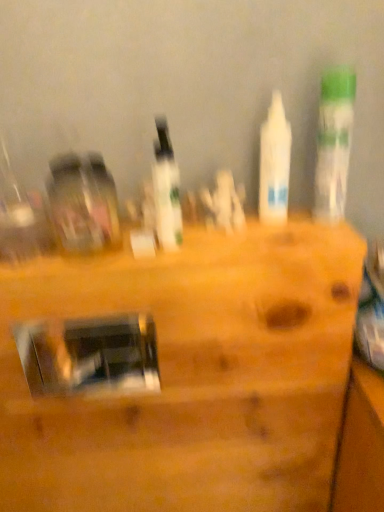
Question: In which direction should I rotate to look at white matte bottle at center, which is the 2th bottle from right to left?

Choices:
 (A) right
 (B) left

Answer: (A)

Question: Is white matte bottle at center, which is the 2th bottle from right to left, with metallic silver mirror at center?

Choices:
 (A) no
 (B) yes

Answer: (A)

Question: Are white matte bottle at center, which is the 2th bottle from right to left, and metallic silver mirror at center located far from each other?

Choices:
 (A) no
 (B) yes

Answer: (A)

Question: Could you tell me if white matte bottle at center, which is the 2th bottle from right to left, is turned towards metallic silver mirror at center?

Choices:
 (A) yes
 (B) no

Answer: (B)

Question: Does white matte bottle at center, which is the 2th bottle from right to left, have a lesser height compared to metallic silver mirror at center?

Choices:
 (A) yes
 (B) no

Answer: (A)

Question: Considering the relative sizes of white matte bottle at center, the 2th bottle in the left-to-right sequence, and metallic silver mirror at center in the image provided, is white matte bottle at center, the 2th bottle in the left-to-right sequence, thinner than metallic silver mirror at center?

Choices:
 (A) no
 (B) yes

Answer: (B)

Question: From the image's perspective, does white matte bottle at center, the 2th bottle in the left-to-right sequence, appear lower than metallic silver mirror at center?

Choices:
 (A) no
 (B) yes

Answer: (A)

Question: From a real-world perspective, does white matte bottle at center, the 2th bottle in the left-to-right sequence, stand above white glossy bottle at center, arranged as the 3th bottle when viewed from the right?

Choices:
 (A) yes
 (B) no

Answer: (A)

Question: Is white matte bottle at center, the 2th bottle in the left-to-right sequence, far from white glossy bottle at center, arranged as the 3th bottle when viewed from the right?

Choices:
 (A) yes
 (B) no

Answer: (B)

Question: Is white matte bottle at center, which is the 2th bottle from right to left, taller than white glossy bottle at center, arranged as the 3th bottle when viewed from the right?

Choices:
 (A) no
 (B) yes

Answer: (B)

Question: From the image's perspective, is white matte bottle at center, which is the 2th bottle from right to left, beneath white glossy bottle at center, the first bottle in the left-to-right sequence?

Choices:
 (A) yes
 (B) no

Answer: (B)

Question: Is white matte bottle at center, which is the 2th bottle from right to left, further to camera compared to white glossy bottle at center, arranged as the 3th bottle when viewed from the right?

Choices:
 (A) no
 (B) yes

Answer: (B)

Question: Is white matte bottle at center, the 2th bottle in the left-to-right sequence, at the left side of white glossy bottle at center, the first bottle in the left-to-right sequence?

Choices:
 (A) yes
 (B) no

Answer: (B)

Question: Considering the relative positions of white glossy bottle at upper right, the third bottle positioned from the left, and white glossy bottle at center, arranged as the 3th bottle when viewed from the right, in the image provided, is white glossy bottle at upper right, the third bottle positioned from the left, to the left of white glossy bottle at center, arranged as the 3th bottle when viewed from the right, from the viewer's perspective?

Choices:
 (A) no
 (B) yes

Answer: (A)